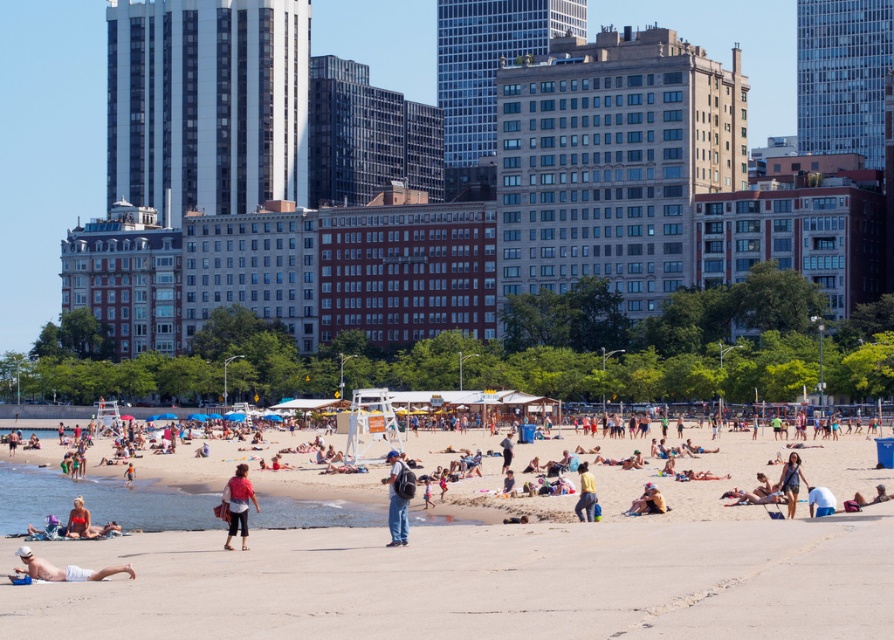
Which is more to the left, yellow knit sweater at center or tan leather bag at center?

yellow knit sweater at center is more to the left.

Can you confirm if yellow knit sweater at center is positioned to the left of tan leather bag at center?

Yes, yellow knit sweater at center is to the left of tan leather bag at center.

Locate an element on the screen. yellow knit sweater at center is located at coordinates (585, 493).

Which is more to the left, matte pink shirt at center or yellow knit sweater at center?

matte pink shirt at center is more to the left.

From the picture: Who is shorter, matte pink shirt at center or yellow knit sweater at center?

Standing shorter between the two is yellow knit sweater at center.

Measure the distance between point (232, 536) and camera.

A distance of 47.27 meters exists between point (232, 536) and camera.

Image resolution: width=894 pixels, height=640 pixels. I want to click on matte pink shirt at center, so click(x=238, y=504).

Between denim shorts at lower right and yellow knit sweater at center, which one has less height?

yellow knit sweater at center

Where is `denim shorts at lower right`? This screenshot has height=640, width=894. denim shorts at lower right is located at coordinates (791, 481).

Does point (786, 492) lie behind point (592, 506)?

No, (786, 492) is in front of (592, 506).

Identify the location of denim shorts at lower right. (791, 481).